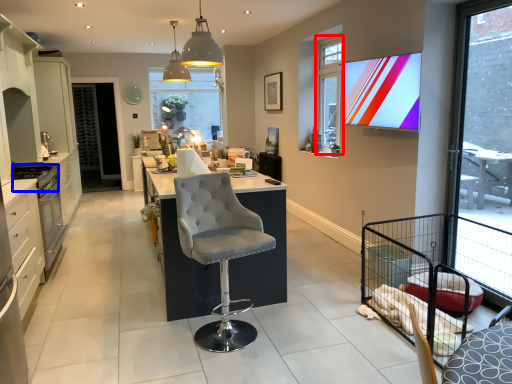
Question: Among these objects, which one is nearest to the camera, window (highlighted by a red box) or appliance (highlighted by a blue box)?

Choices:
 (A) window
 (B) appliance

Answer: (B)